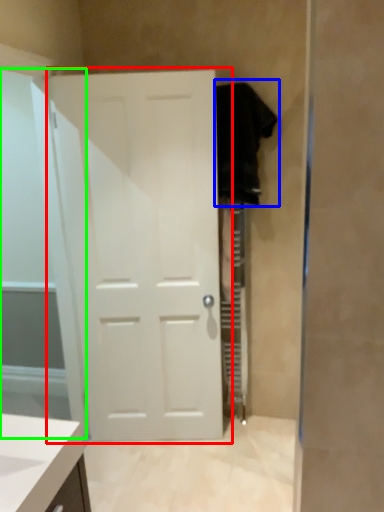
Question: Based on their relative distances, which object is nearer to door (highlighted by a red box)? Choose from robe (highlighted by a blue box) and glass door (highlighted by a green box).

Choices:
 (A) robe
 (B) glass door

Answer: (B)